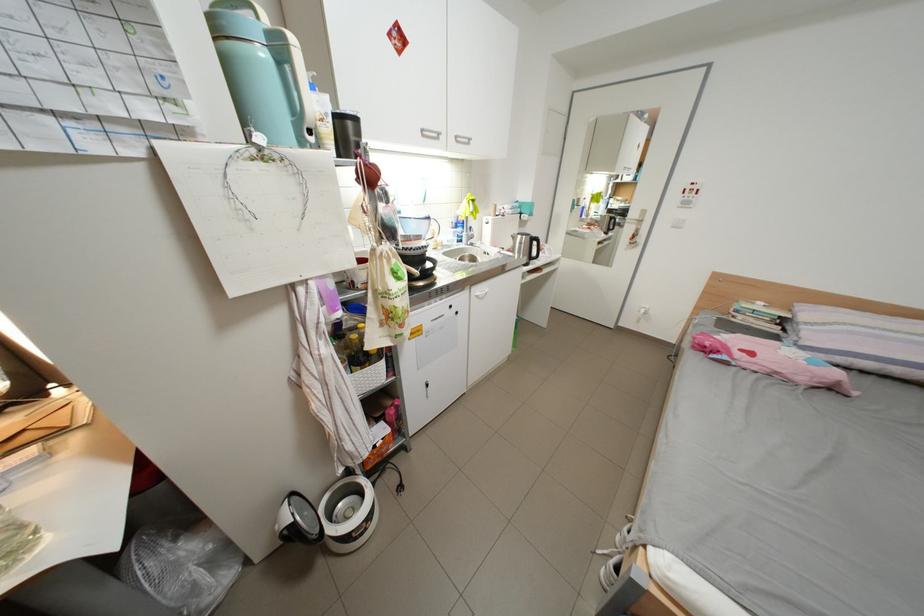
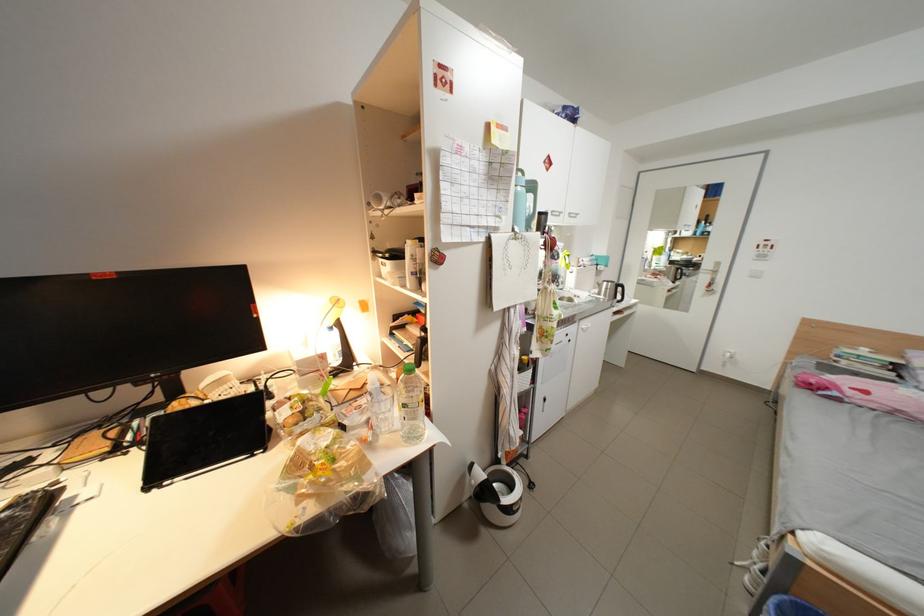
The point at [751,318] is marked in the first image. Where is the corresponding point in the second image?

(856, 363)